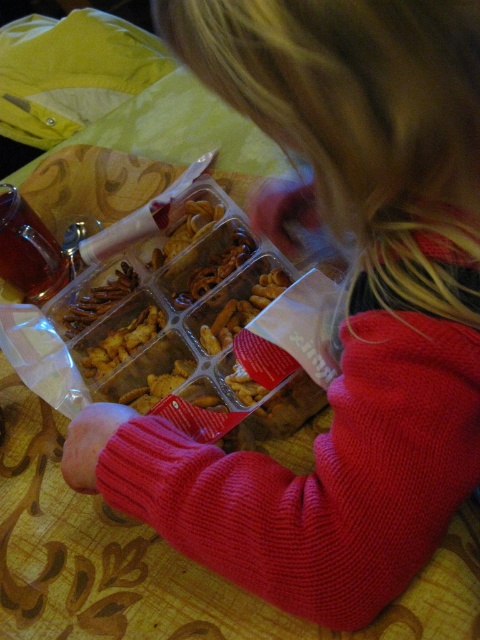
Between matte plastic snack tray at center and brown matte snack at center, which one has more height?

matte plastic snack tray at center

Is matte plastic snack tray at center thinner than brown matte snack at center?

Incorrect, matte plastic snack tray at center's width is not less than brown matte snack at center's.

Describe the element at coordinates (204, 342) in the screenshot. I see `matte plastic snack tray at center` at that location.

Locate an element on the screen. matte plastic snack tray at center is located at coordinates (204, 342).

Is brown matte snack at center above brown matte pretzel at center?

Incorrect, brown matte snack at center is not positioned above brown matte pretzel at center.

Which of these two, brown matte snack at center or brown matte pretzel at center, stands shorter?

Standing shorter between the two is brown matte snack at center.

This screenshot has height=640, width=480. Identify the location of brown matte snack at center. (121, 342).

Where is `brown matte snack at center`? The height and width of the screenshot is (640, 480). brown matte snack at center is located at coordinates (121, 342).

What are the coordinates of `matte plastic snack tray at center` in the screenshot? It's located at (204, 342).

Find the location of a particular element. Image resolution: width=480 pixels, height=640 pixels. matte plastic snack tray at center is located at coordinates (204, 342).